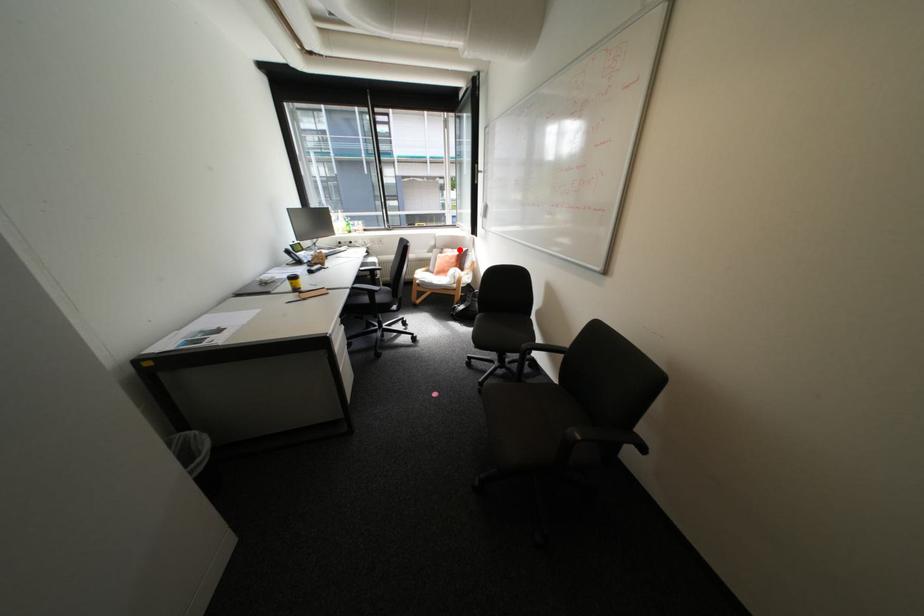
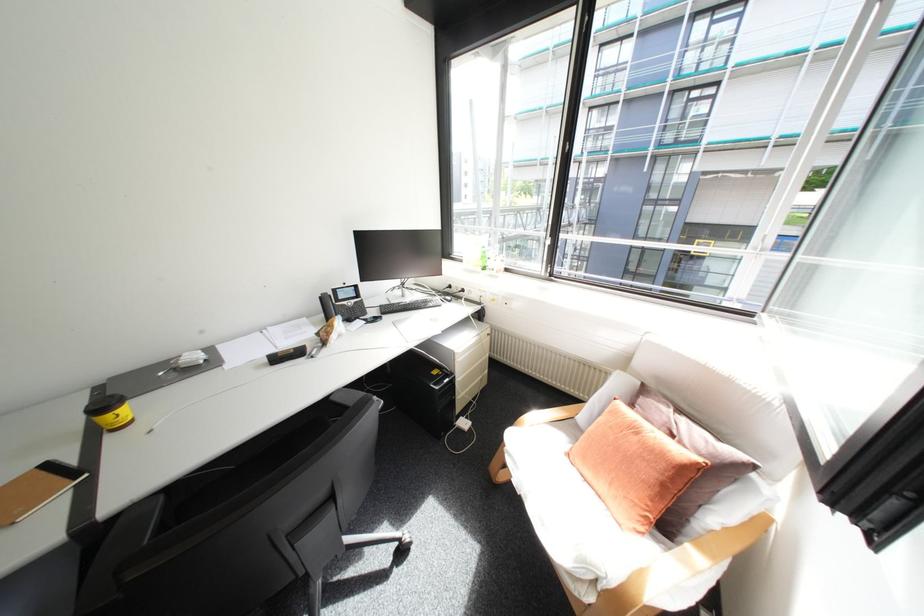
Question: I am providing you with two images of the same scene from different viewpoints. A red point is shown in image1. For the corresponding object point in image2, is it positioned nearer or farther from the camera?

Choices:
 (A) Nearer
 (B) Farther

Answer: (B)